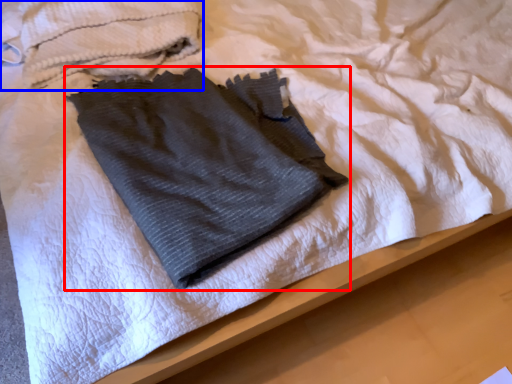
Question: Which point is further to the camera, towel (highlighted by a red box) or towel (highlighted by a blue box)?

Choices:
 (A) towel
 (B) towel

Answer: (B)